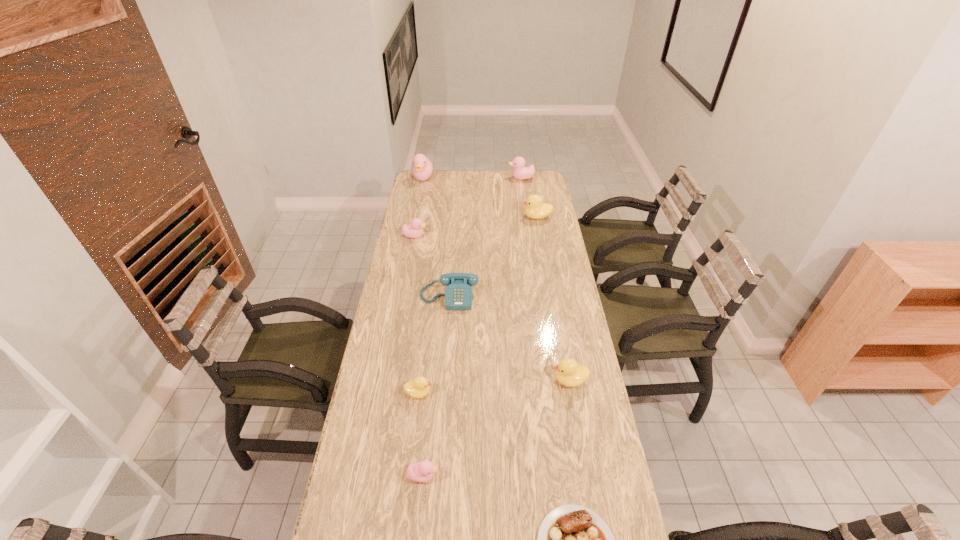
What are the coordinates of `the tallest object` in the screenshot? It's located at (422, 169).

Image resolution: width=960 pixels, height=540 pixels. I want to click on the tallest duckling, so click(422, 169).

Where is `the rightmost pink duckling`? The height and width of the screenshot is (540, 960). the rightmost pink duckling is located at coordinates (520, 172).

This screenshot has height=540, width=960. Find the location of `the seventh nearest object`. the seventh nearest object is located at coordinates (535, 209).

Where is `the fifth nearest duckling`? the fifth nearest duckling is located at coordinates (535, 209).

The image size is (960, 540). I want to click on the sixth nearest object, so click(415, 231).

Find the location of a particular element. The height and width of the screenshot is (540, 960). the fourth nearest duckling is located at coordinates (415, 231).

I want to click on the second smallest yellow duckling, so click(568, 372).

You are a GUI agent. You are given a task and a screenshot of the screen. Output one action in this format:
    pyautogui.click(x=<x>, y=<y>)
    Task: Click on the blue telephone
    This screenshot has height=540, width=960.
    Given the screenshot: What is the action you would take?
    pyautogui.click(x=458, y=295)

Image resolution: width=960 pixels, height=540 pixels. In order to click on telephone in this screenshot , I will do pos(458,295).